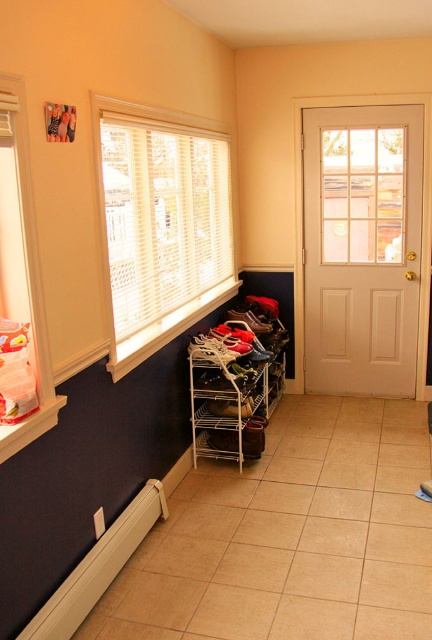
You are standing in the entryway and want to place a new decorative item between the white metal shoe rack at center and the white plastic baseboard at lower left. Which object should you place it closer to if you want it to be closer to you?

You should place the decorative item closer to the white metal shoe rack at center because it is closer to you than the white plastic baseboard at lower left.